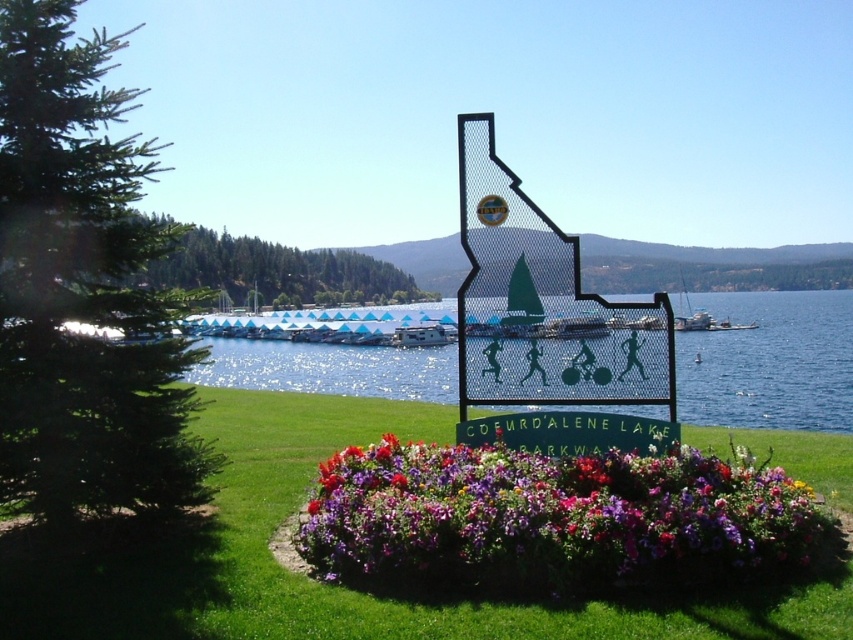
Does vibrant multicolored petals at center have a lesser width compared to metallic silver boat at center?

Incorrect, vibrant multicolored petals at center's width is not less than metallic silver boat at center's.

Is point (494, 512) positioned after point (445, 337)?

No, it is not.

Is point (715, 499) closer to camera compared to point (403, 348)?

Yes, it is.

Identify the location of vibrant multicolored petals at center. The width and height of the screenshot is (853, 640). (550, 516).